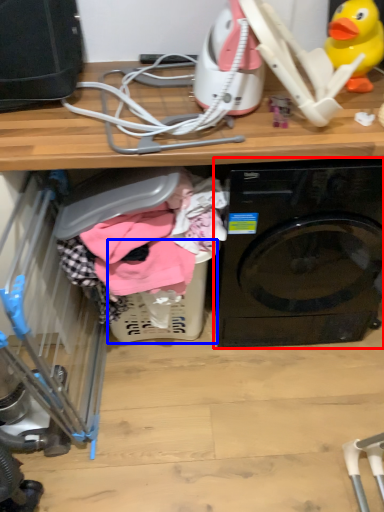
Question: Among these objects, which one is farthest to the camera, washing machine (highlighted by a red box) or basket (highlighted by a blue box)?

Choices:
 (A) washing machine
 (B) basket

Answer: (B)